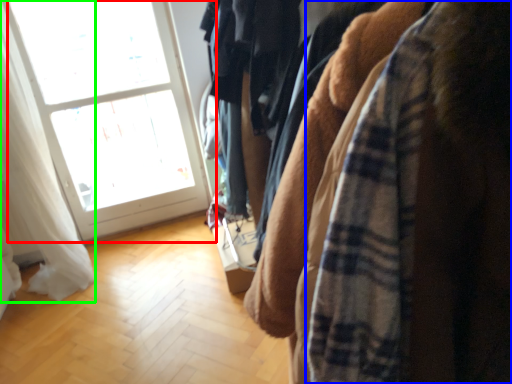
Question: Which object is positioned farthest from window (highlighted by a red box)? Select from flannel (highlighted by a blue box) and curtain (highlighted by a green box).

Choices:
 (A) flannel
 (B) curtain

Answer: (A)